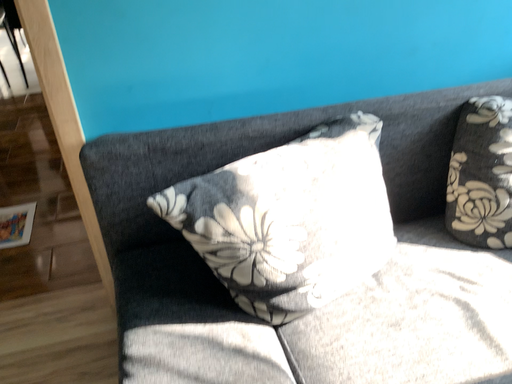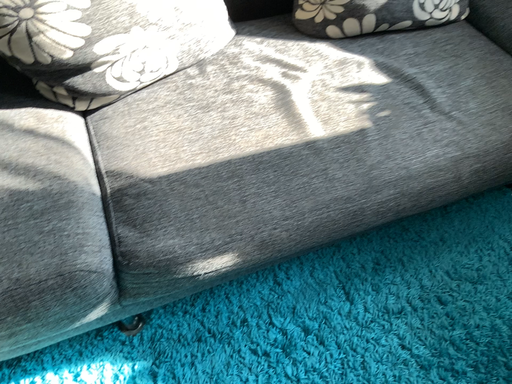
Question: Which way did the camera rotate in the video?

Choices:
 (A) rotated downward
 (B) rotated upward

Answer: (A)